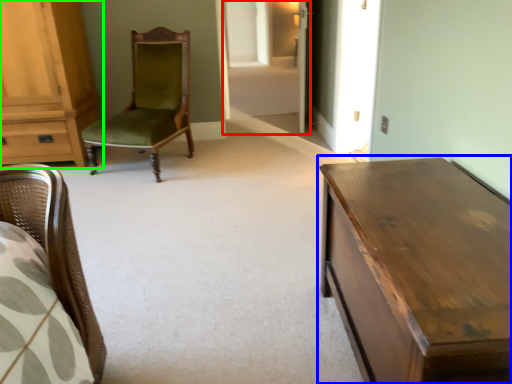
Question: Estimate the real-world distances between objects in this image. Which object is farther from glass door (highlighted by a red box), table (highlighted by a blue box) or cabinetry (highlighted by a green box)?

Choices:
 (A) table
 (B) cabinetry

Answer: (A)